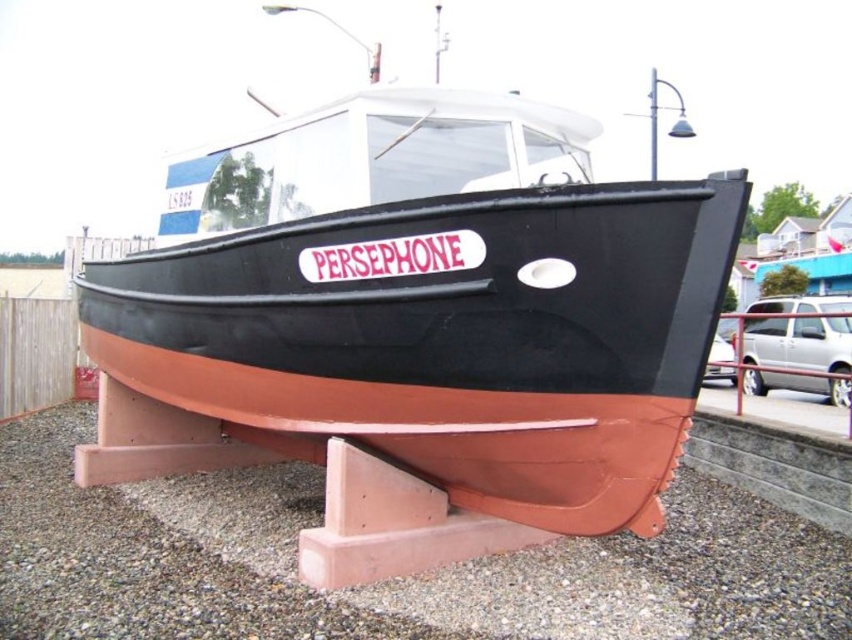
Is point (490, 445) farther from viewer compared to point (661, 557)?

No, (490, 445) is in front of (661, 557).

Between point (419, 253) and point (6, 496), which one is positioned in front?

Positioned in front is point (419, 253).

You are a GUI agent. You are given a task and a screenshot of the screen. Output one action in this format:
    pyautogui.click(x=<x>, y=<y>)
    Task: Click on the brown matte boat at center
    Image resolution: width=852 pixels, height=640 pixels.
    Given the screenshot: What is the action you would take?
    pyautogui.click(x=418, y=308)